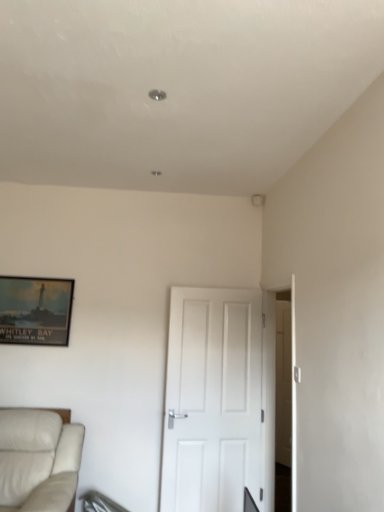
Where is `matte black picture frame at upper left`? The height and width of the screenshot is (512, 384). matte black picture frame at upper left is located at coordinates (35, 310).

What do you see at coordinates (38, 460) in the screenshot? I see `white leather studio couch at lower left` at bounding box center [38, 460].

The height and width of the screenshot is (512, 384). I want to click on matte black picture frame at upper left, so click(35, 310).

At what (x,y) coordinates should I click in order to perform the action: click on picture frame that is above the white matte door at center (from the image's perspective). Please return your answer as a coordinate pair (x, y). Image resolution: width=384 pixels, height=512 pixels. Looking at the image, I should click on (35, 310).

Are white matte door at center and matte black picture frame at upper left making contact?

They are not placed beside each other.

In the image, is matte black picture frame at upper left on the left side or the right side of white matte door at center?

In the image, matte black picture frame at upper left appears on the left side of white matte door at center.

How many degrees apart are the facing directions of matte black picture frame at upper left and white matte door at center?

The angular difference between matte black picture frame at upper left and white matte door at center is 7.59 degrees.

Is matte black picture frame at upper left positioned with its back to white matte door at center?

No, matte black picture frame at upper left is not facing the opposite direction of white matte door at center.

Who is bigger, matte black picture frame at upper left or white matte door at center?

white matte door at center is bigger.

Is matte black picture frame at upper left in front of or behind white leather studio couch at lower left in the image?

In the image, matte black picture frame at upper left appears behind white leather studio couch at lower left.

Find the location of `studio couch that is on the right side of matte black picture frame at upper left`. studio couch that is on the right side of matte black picture frame at upper left is located at coordinates (38, 460).

Would you consider matte black picture frame at upper left to be distant from white leather studio couch at lower left?

No, there isn't a large distance between matte black picture frame at upper left and white leather studio couch at lower left.

Is matte black picture frame at upper left outside of white leather studio couch at lower left?

Absolutely, matte black picture frame at upper left is external to white leather studio couch at lower left.

In the scene shown: Is white matte door at center far away from white leather studio couch at lower left?

white matte door at center is positioned a significant distance from white leather studio couch at lower left.

Is point (167, 407) closer or farther from the camera than point (21, 480)?

Point (167, 407) appears to be farther away from the viewer than point (21, 480).

Considering the relative sizes of white matte door at center and white leather studio couch at lower left in the image provided, is white matte door at center bigger than white leather studio couch at lower left?

Actually, white matte door at center might be smaller than white leather studio couch at lower left.

Do you think white matte door at center is within white leather studio couch at lower left, or outside of it?

white matte door at center lies outside white leather studio couch at lower left.

Is matte black picture frame at upper left at the back of white leather studio couch at lower left?

That's not correct — white leather studio couch at lower left is not looking away from matte black picture frame at upper left.

Does white leather studio couch at lower left have a smaller size compared to matte black picture frame at upper left?

No.

Between white leather studio couch at lower left and matte black picture frame at upper left, which one has less height?

Standing shorter between the two is matte black picture frame at upper left.

From a real-world perspective, between white leather studio couch at lower left and matte black picture frame at upper left, who is vertically lower?

white leather studio couch at lower left is physically lower.

Is white leather studio couch at lower left further to the viewer compared to white matte door at center?

No, white leather studio couch at lower left is closer to the camera.

Is point (11, 496) closer or farther from the camera than point (232, 457)?

Point (11, 496) is closer to the camera than point (232, 457).

From a real-world perspective, is white leather studio couch at lower left below white matte door at center?

Yes, from a real-world perspective, white leather studio couch at lower left is beneath white matte door at center.

Where is `picture frame above the white matte door at center (from a real-world perspective)`? picture frame above the white matte door at center (from a real-world perspective) is located at coordinates (35, 310).

You are a GUI agent. You are given a task and a screenshot of the screen. Output one action in this format:
    pyautogui.click(x=<x>, y=<y>)
    Task: Click on the door lying below the matte black picture frame at upper left (from the image's perspective)
    The height and width of the screenshot is (512, 384).
    Given the screenshot: What is the action you would take?
    pyautogui.click(x=219, y=400)

When comparing their distances from white matte door at center, does matte black picture frame at upper left or white leather studio couch at lower left seem closer?

white leather studio couch at lower left lies closer to white matte door at center than the other object.

Which object lies nearer to the anchor point white leather studio couch at lower left, white matte door at center or matte black picture frame at upper left?

The object closer to white leather studio couch at lower left is matte black picture frame at upper left.

Which object lies further to the anchor point matte black picture frame at upper left, white leather studio couch at lower left or white matte door at center?

Based on the image, white matte door at center appears to be further to matte black picture frame at upper left.

Estimate the real-world distances between objects in this image. Which object is closer to matte black picture frame at upper left, white matte door at center or white leather studio couch at lower left?

white leather studio couch at lower left is positioned closer to the anchor matte black picture frame at upper left.

Considering their positions, is white leather studio couch at lower left positioned closer to white matte door at center than matte black picture frame at upper left?

white leather studio couch at lower left lies closer to white matte door at center than the other object.

Based on the photo, looking at the image, which one is located closer to white leather studio couch at lower left, matte black picture frame at upper left or white matte door at center?

matte black picture frame at upper left.

Find the location of a particular element. studio couch located between matte black picture frame at upper left and white matte door at center in the left-right direction is located at coordinates (38, 460).